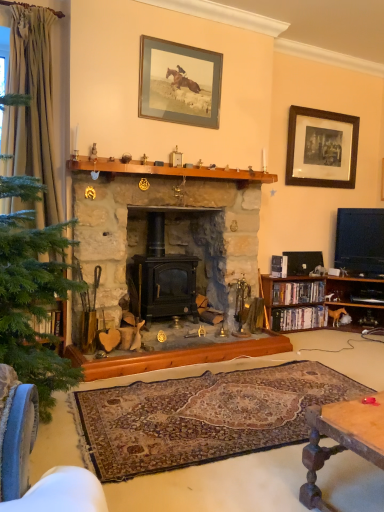
This screenshot has width=384, height=512. In order to click on free space above black plastic dvds at right, the first book in the bottom-to-top sequence (from a real-world perspective) in this screenshot , I will do `click(296, 308)`.